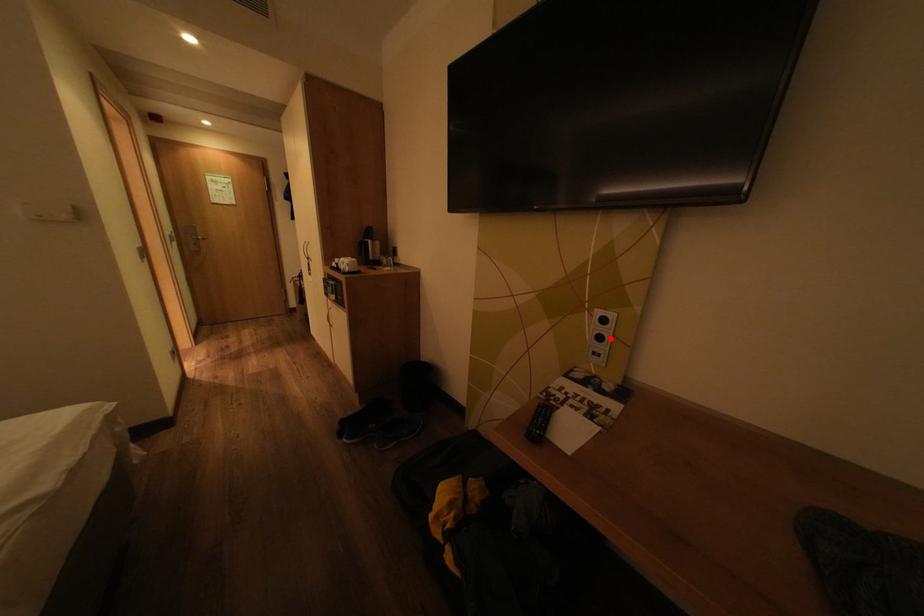
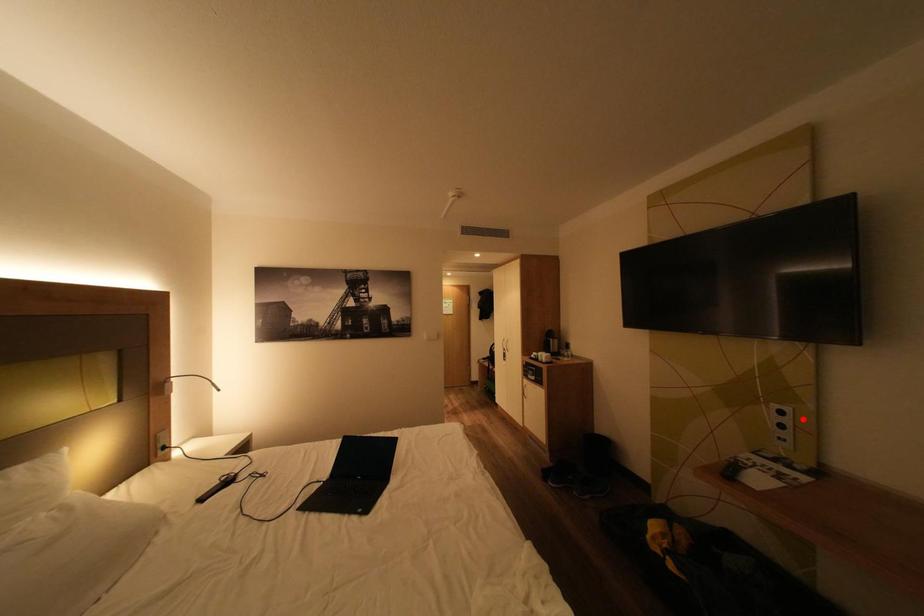
I am providing you with two images of the same scene from different viewpoints. A red point is marked on the first image and another point is marked on the second image. Does the point marked in image1 correspond to the same location as the one in image2?

No